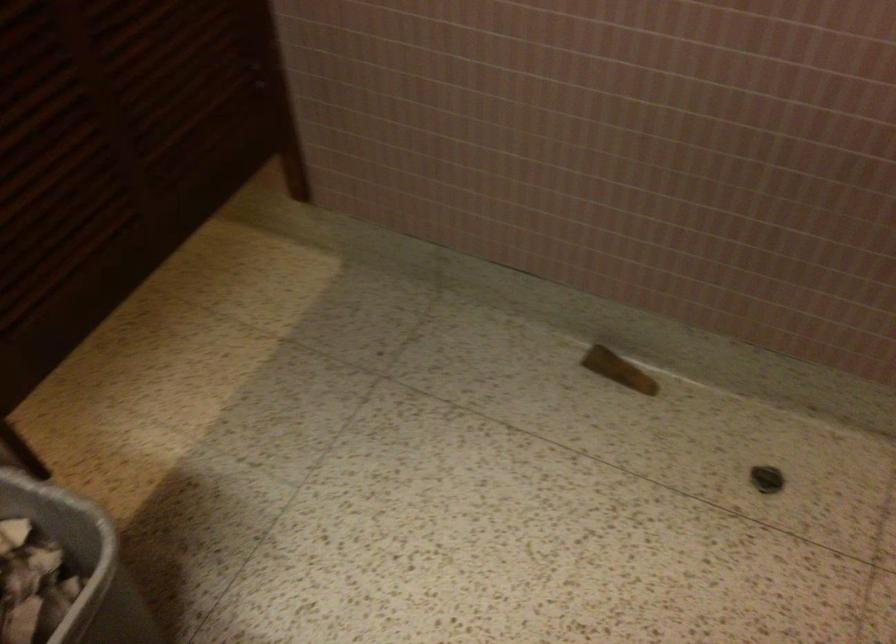
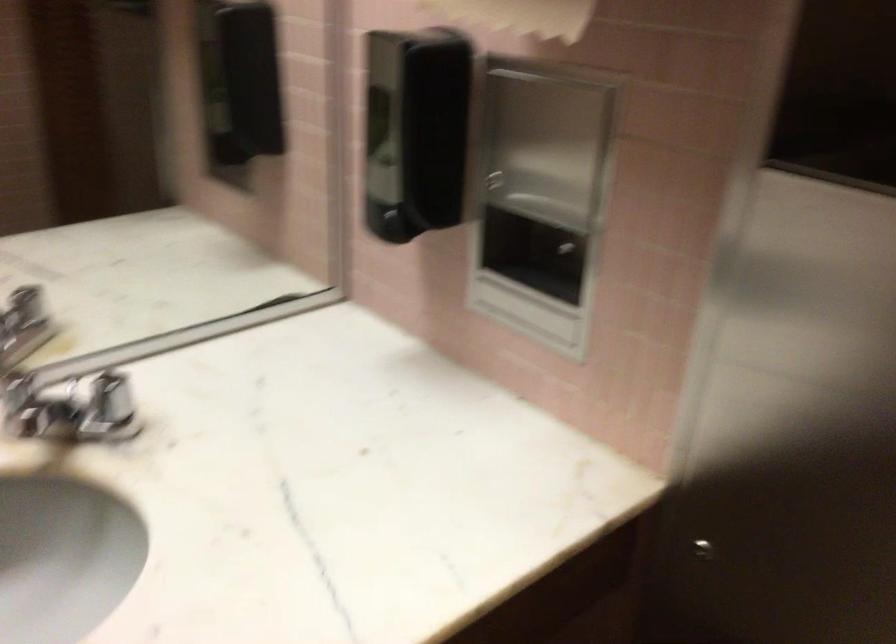
The first image is from the beginning of the video and the second image is from the end. How did the camera likely rotate when shooting the video?

The rotation direction of the camera is left-down.